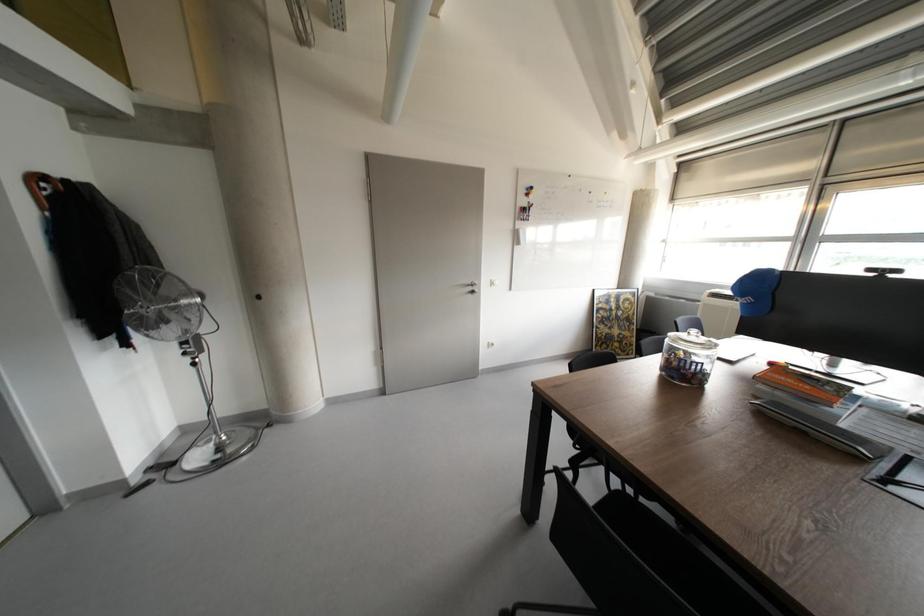
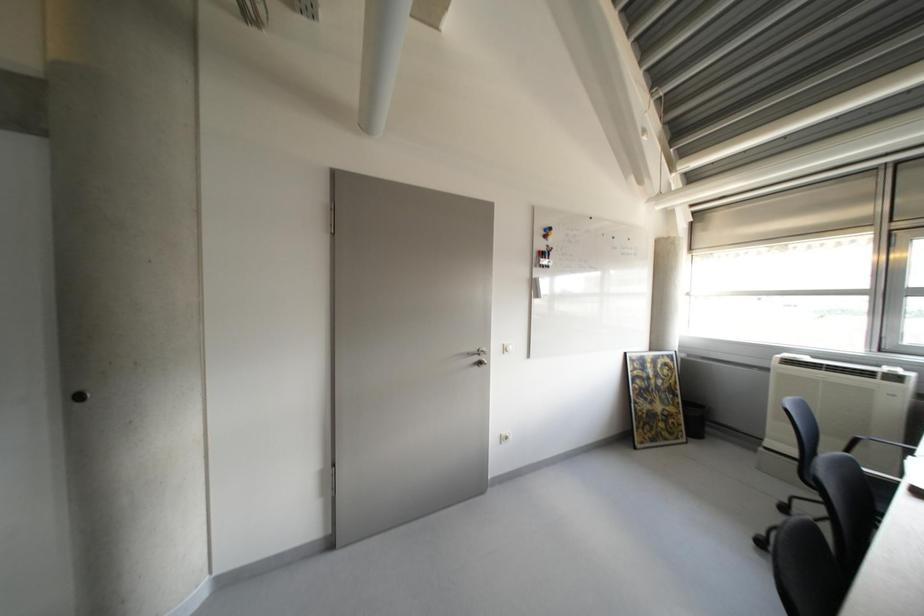
Question: In a continuous first-person perspective shot, in which direction is the camera moving?

Choices:
 (A) Left
 (B) Right
 (C) Forward
 (D) Backward

Answer: (C)